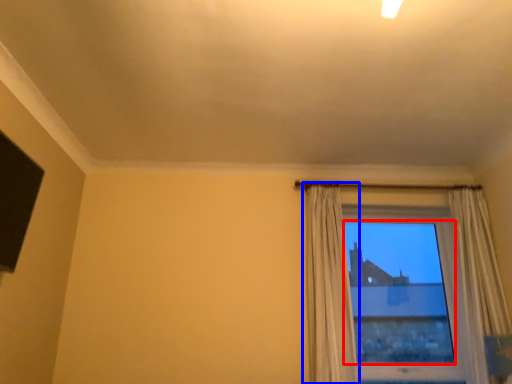
Question: Which point is closer to the camera, window screen (highlighted by a red box) or curtain (highlighted by a blue box)?

Choices:
 (A) window screen
 (B) curtain

Answer: (B)